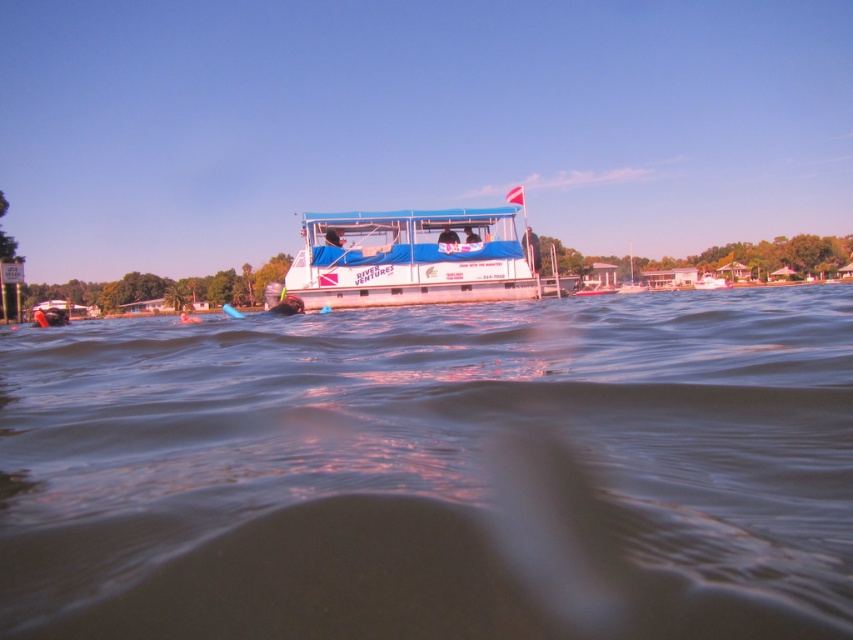
Question: Is the position of clear water at center less distant than that of blue rubber ring at upper center?

Choices:
 (A) yes
 (B) no

Answer: (A)

Question: Does white plastic boat at center appear on the left side of matte black wetsuit at center?

Choices:
 (A) no
 (B) yes

Answer: (B)

Question: Which point appears farthest from the camera in this image?

Choices:
 (A) (456, 243)
 (B) (250, 339)
 (C) (466, 228)

Answer: (C)

Question: Which point is farther to the camera?

Choices:
 (A) white plastic boat at center
 (B) clear water at center

Answer: (A)

Question: Estimate the real-world distances between objects in this image. Which object is closer to the matte black wetsuit at center?

Choices:
 (A) white plastic boat at center
 (B) clear water at center

Answer: (A)

Question: Can you confirm if blue rubber ring at upper center is positioned below matte black wetsuit at center?

Choices:
 (A) yes
 (B) no

Answer: (A)